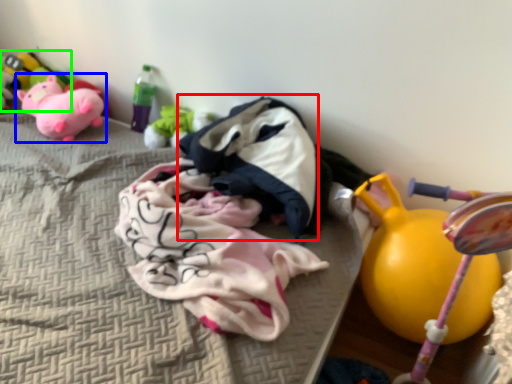
Question: Which object is the farthest from clothing (highlighted by a red box)? Choose among these: toy (highlighted by a blue box) or toy (highlighted by a green box).

Choices:
 (A) toy
 (B) toy

Answer: (B)